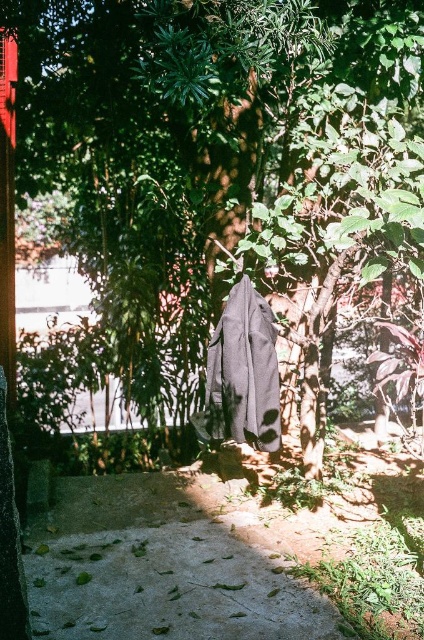
You are standing at the origin point of the coordinate system in the image. Where is the green leafy tree at center located?

The green leafy tree at center is located at point (200, 132).

You are a gardener who needs to place a new potted plant in this garden. The potted plant has a diameter of 30 cm. Looking at the concrete at lower center and the dark gray fabric robe at center, which object can accommodate the plant based on their size?

The concrete at lower center is larger in size than the dark gray fabric robe at center, so the concrete at lower center can accommodate the 30 cm diameter potted plant.